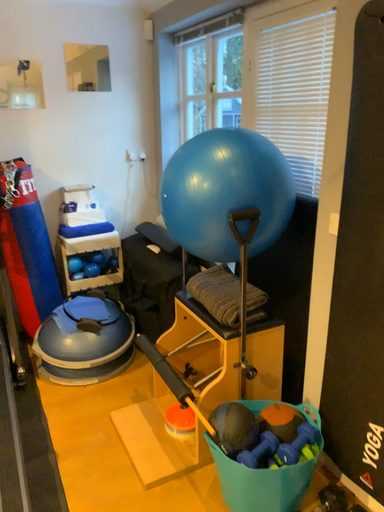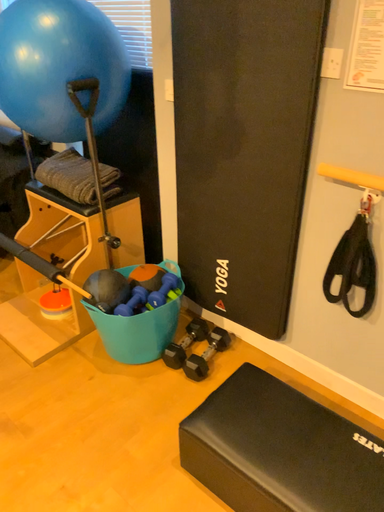
Question: How did the camera likely rotate when shooting the video?

Choices:
 (A) rotated downward
 (B) rotated upward

Answer: (A)